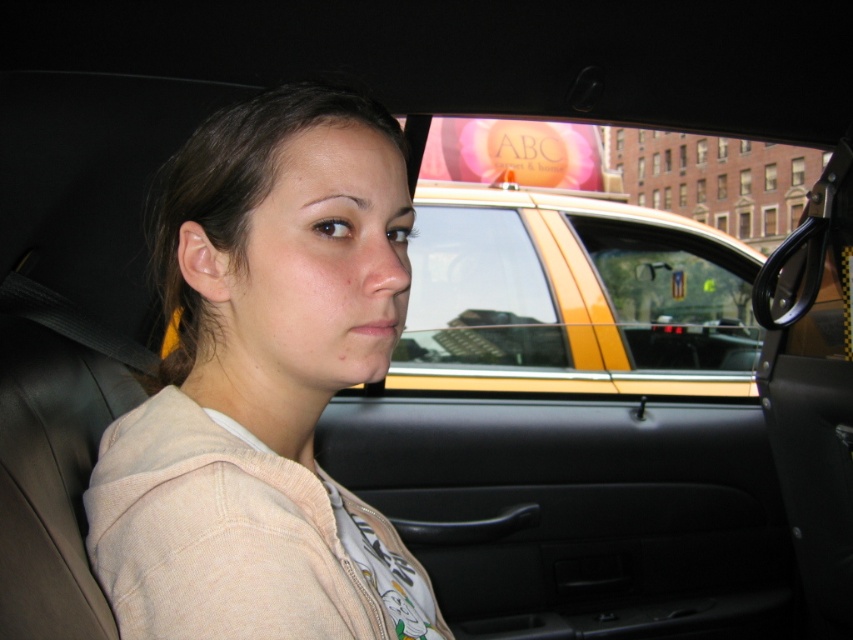
You are a passenger in the back seat of a car and want to know which object in front of you is narrower between the light beige hoodie at center and the yellow plastic taxi at center. Which one is narrower?

The light beige hoodie at center is thinner than the yellow plastic taxi at center, so the light beige hoodie at center is narrower.